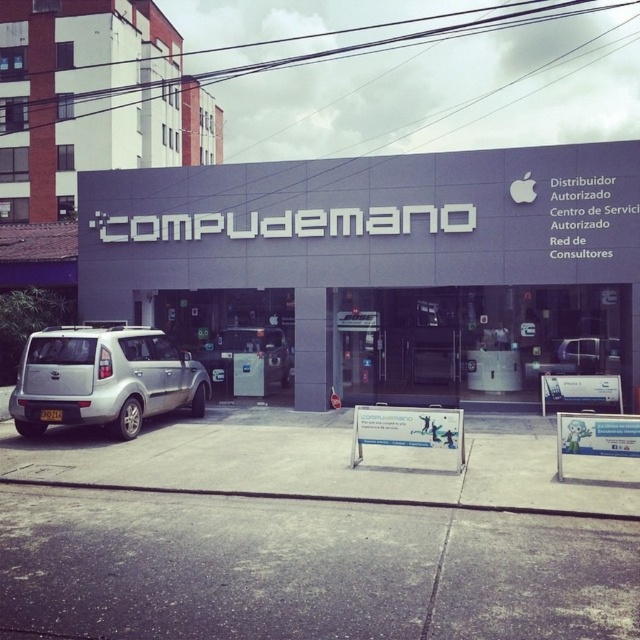
You are a delivery person who needs to park your truck next to the matte gray building at center. The truck is 2 meters wide. Can you park your truck without overlapping the silver metallic van at lower left?

The matte gray building at center is wider than the silver metallic van at lower left, so the truck can park next to the matte gray building at center without overlapping the van as long as it stays within the building side.